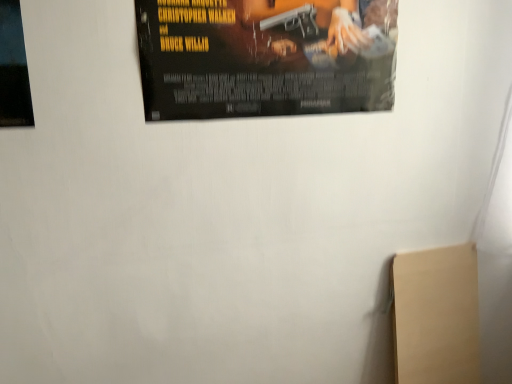
Identify the location of beige cardboard box at lower right. (436, 315).

Describe the element at coordinates (436, 315) in the screenshot. I see `beige cardboard box at lower right` at that location.

Where is `beige cardboard box at lower right`? This screenshot has width=512, height=384. beige cardboard box at lower right is located at coordinates (436, 315).